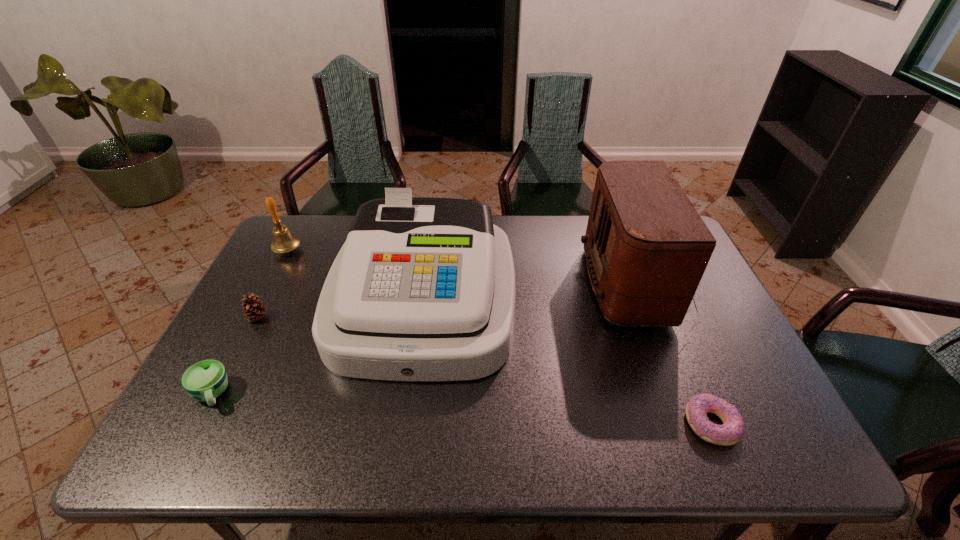
I want to click on blank space located on the back of the bell, so click(306, 215).

The image size is (960, 540). I want to click on vacant area situated on the right of the third shortest object, so click(286, 318).

The height and width of the screenshot is (540, 960). I want to click on vacant space located 0.120m on the right of the cup, so click(x=281, y=394).

In order to click on free region located 0.300m on the left of the doughnut in this screenshot , I will do pyautogui.click(x=551, y=424).

Locate an element on the screen. The image size is (960, 540). radio receiver at the far edge is located at coordinates (647, 248).

The image size is (960, 540). Identify the location of cash register that is at the far edge. (423, 290).

Identify the location of bell situated at the far edge. (284, 241).

Locate an element on the screen. object that is at the near edge is located at coordinates (733, 428).

You are a GUI agent. You are given a task and a screenshot of the screen. Output one action in this format:
    pyautogui.click(x=<x>, y=<y>)
    Task: Click on the bell located at the left edge
    The height and width of the screenshot is (540, 960).
    Given the screenshot: What is the action you would take?
    pyautogui.click(x=284, y=241)

Where is `pinecone located in the left edge section of the desktop`? pinecone located in the left edge section of the desktop is located at coordinates (254, 310).